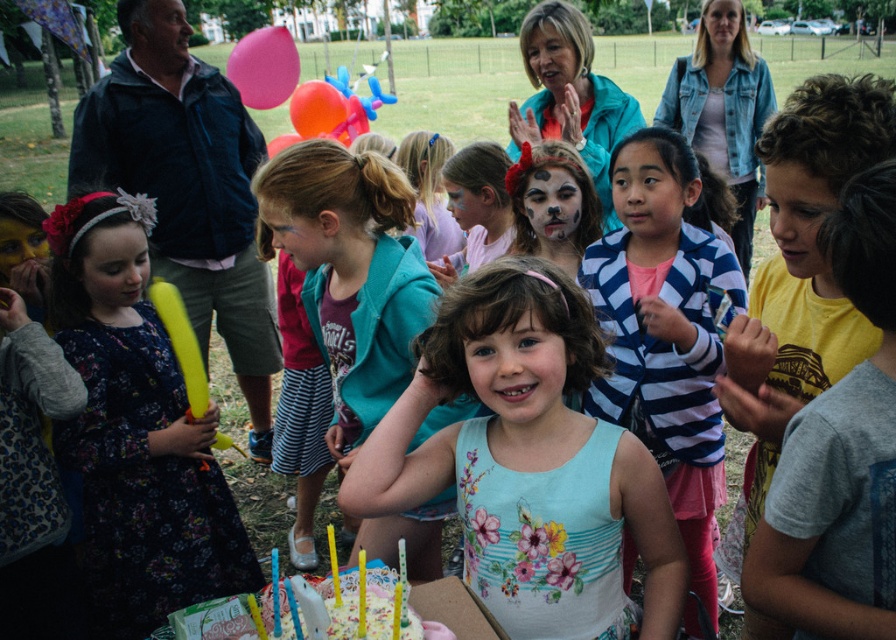
You are a photographer at the birthday party and want to capture a photo of the floral printed tank top at center and the striped cotton jacket at center. Which one is positioned lower in the image?

The floral printed tank top at center is located below the striped cotton jacket at center, so it is positioned lower in the image.

You are a photographer at the birthday party. You want to take a photo of the striped cotton jacket at center and the white frosted cake with candles at center. Can you fit both in the frame if your camera has a 3 feet wide field of view?

The striped cotton jacket at center and the white frosted cake with candles at center are 3.43 feet apart. Since the distance between them is greater than the camera field of view of 3 feet, you cannot fit both in the frame.

You are standing at the position of point (633, 180) and want to walk towards the birthday cake. There is a point at (493, 440) in your path. Is this point in front of or behind you relative to your direction of movement?

The point (493, 440) is in front of point (633, 180), so it is in front of you as you walk towards the birthday cake.